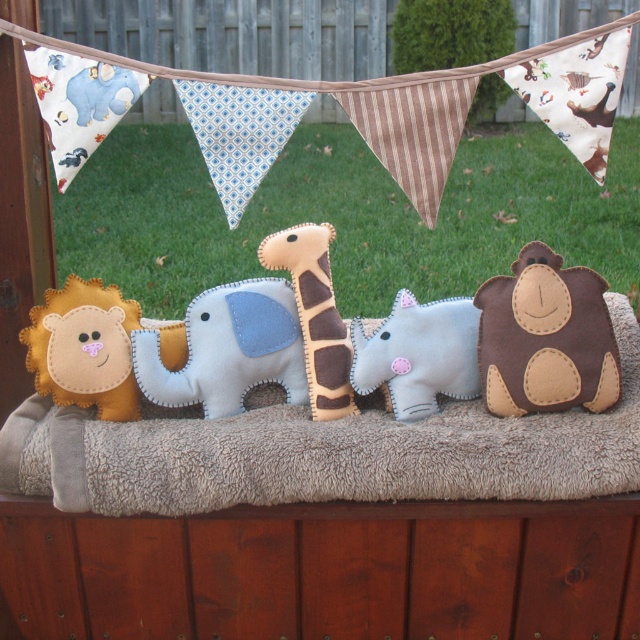
You are a toy organizer who needs to place a new felt zebra between the felt elephant at center and the soft felt giraffe at center. The zebra is 2 inches wide. Is there enough space between them to fit the zebra without overlapping?

The distance between the felt elephant at center and the soft felt giraffe at center is 4.83 inches. Since the zebra is 2 inches wide, there is sufficient space to place it between them without overlapping.

You are an interior designer arranging a childrens playroom. You need to place a new toy at the point marked by the coordinates (419, 355). Which existing felt animal pillow should you place it next to?

The point marked by the coordinates (419, 355) indicates the location of the white felt baby elephant at center, so you should place the new toy next to the white felt baby elephant at center.

From the picture: You are setting up a display for a childrens party and have the brown felt monkey at center and the white felt baby elephant at center in front of you. Which animal is taller?

The brown felt monkey at center is taller than the white felt baby elephant at center.